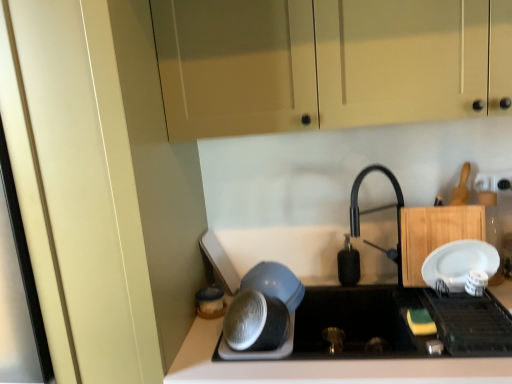
The height and width of the screenshot is (384, 512). What are the coordinates of `vacant region in front of white glossy plate at upper right, which is the fourth appliance in left-to-right order` in the screenshot? It's located at (489, 330).